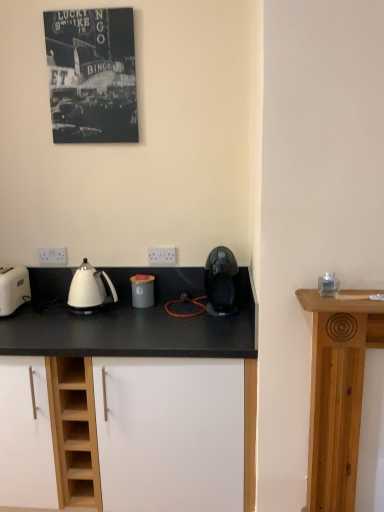
Question: Is white plastic electric outlet at lower left, which is counted as the 1th electric outlet, starting from the back, inside the boundaries of white plastic electric outlet at center, the second electric outlet from the back, or outside?

Choices:
 (A) inside
 (B) outside

Answer: (B)

Question: Is white plastic electric outlet at lower left, the second electric outlet positioned from the right, wider or thinner than white plastic electric outlet at center, arranged as the first electric outlet when viewed from the front?

Choices:
 (A) wide
 (B) thin

Answer: (A)

Question: Based on their relative distances, which object is farther from the clear glass candle at upper right?

Choices:
 (A) white plastic electric outlet at lower left, the second electric outlet positioned from the right
 (B) matte gray canister at center, the 1th kitchen appliance in the left-to-right sequence
 (C) black canvas poster at upper left
 (D) black plastic coffee machine at center, acting as the 1th kitchen appliance starting from the right
 (E) white matte cabinet at center

Answer: (C)

Question: Which of these objects is positioned farthest from the white plastic toaster at left?

Choices:
 (A) white glossy kettle at left
 (B) matte gray canister at center, which is the 2th kitchen appliance from right to left
 (C) white plastic electric outlet at center, the second electric outlet from the back
 (D) black canvas poster at upper left
 (E) black plastic coffee machine at center, the second kitchen appliance in the left-to-right sequence

Answer: (D)